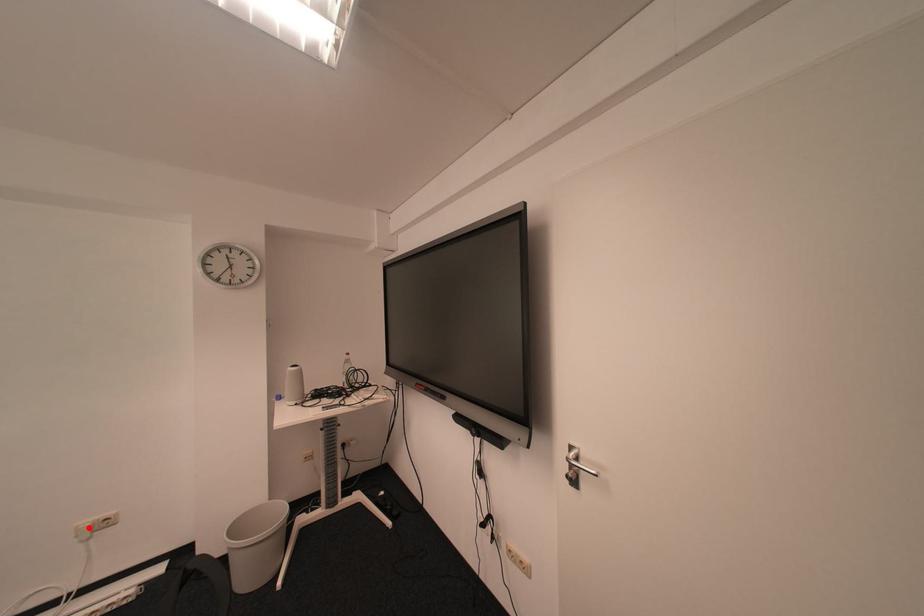
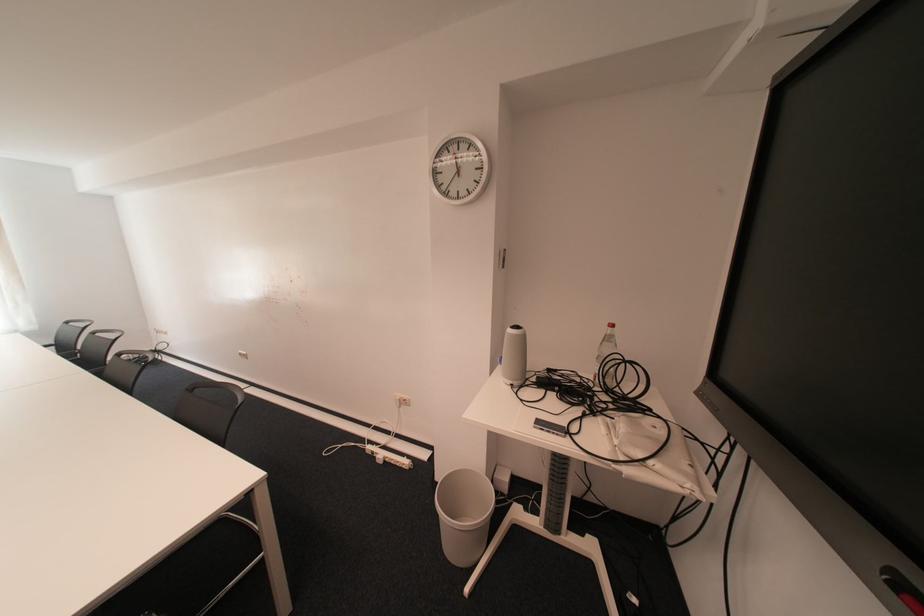
Question: A red point is marked in image1. In image2, is the corresponding 3D point closer to the camera or farther? Reply with the corresponding letter.

Choices:
 (A) The corresponding 3D point is closer.
 (B) The corresponding 3D point is farther.

Answer: (A)